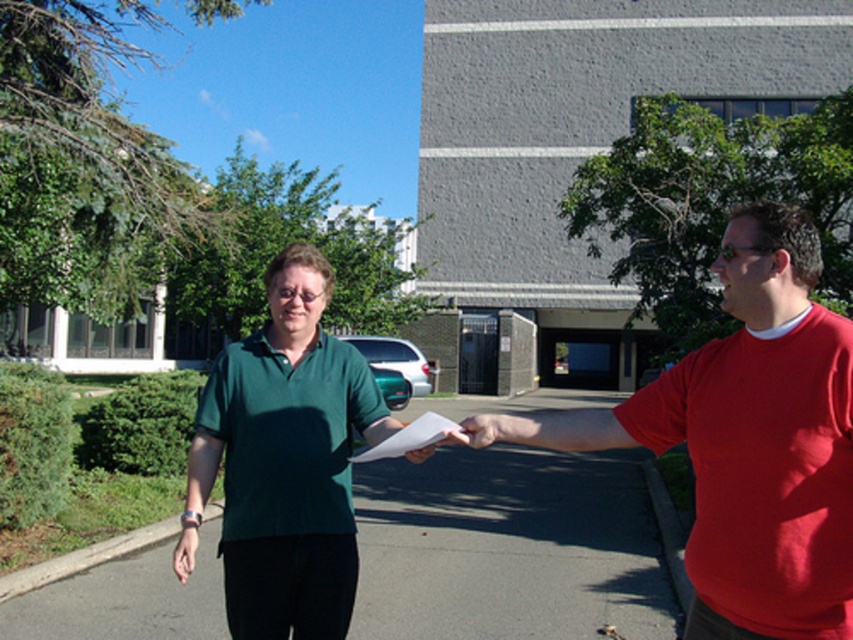
You are a photographer trying to capture a clear photo of the green matte shirt at center and the matte white paper at center. Which object should you focus on first if you want to ensure both are in focus, considering their sizes?

The green matte shirt at center is bigger than the matte white paper at center, so focusing on the larger object first would help ensure both are in focus.